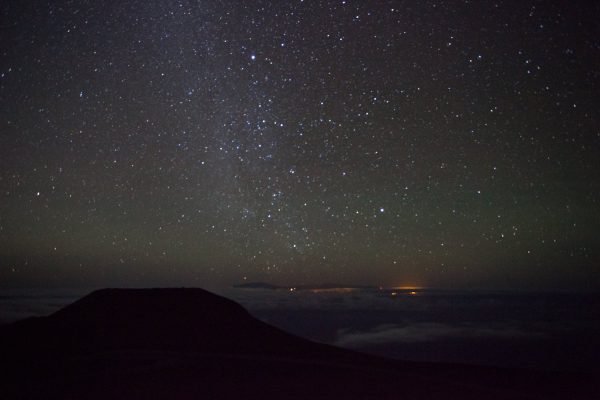
Where is `light area`? light area is located at coordinates (391, 332).